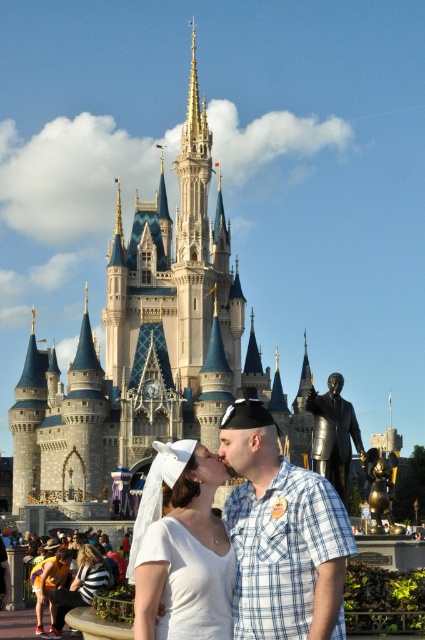
Question: Based on their relative distances, which object is farther from the white fabric veil at center?

Choices:
 (A) white satin veil at lower center
 (B) blue plaid shirt at center
 (C) golden stone castle at upper center
 (D) shiny bronze statue at center

Answer: (C)

Question: Which point appears farthest from the camera in this image?

Choices:
 (A) (323, 577)
 (B) (331, 404)

Answer: (B)

Question: Which point is closer to the camera taking this photo?

Choices:
 (A) (107, 577)
 (B) (285, 500)

Answer: (B)

Question: Is golden stone castle at upper center to the left of blue plaid shirt at center from the viewer's perspective?

Choices:
 (A) yes
 (B) no

Answer: (A)

Question: Can you confirm if blue plaid shirt at center is positioned above white satin veil at lower center?

Choices:
 (A) yes
 (B) no

Answer: (A)

Question: Considering the relative positions of blue plaid shirt at center and white satin veil at lower center in the image provided, where is blue plaid shirt at center located with respect to white satin veil at lower center?

Choices:
 (A) right
 (B) left

Answer: (A)